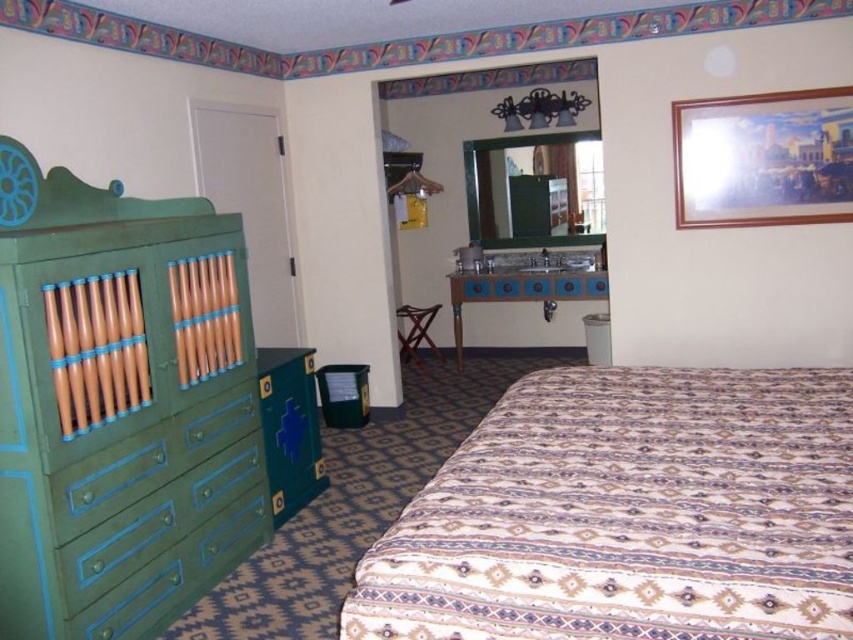
Can you confirm if green painted wood dresser at left is bigger than green matte drawer at left?

Yes, green painted wood dresser at left is bigger than green matte drawer at left.

What do you see at coordinates (119, 404) in the screenshot? I see `green painted wood dresser at left` at bounding box center [119, 404].

Locate an element on the screen. The image size is (853, 640). green painted wood dresser at left is located at coordinates (119, 404).

Which is more to the right, patterned fabric bed at lower right or green matte drawer at left?

Positioned to the right is patterned fabric bed at lower right.

Who is lower down, patterned fabric bed at lower right or green matte drawer at left?

green matte drawer at left

Which is in front, point (465, 545) or point (155, 580)?

Point (465, 545) is in front.

Identify the location of patterned fabric bed at lower right. tap(630, 515).

Image resolution: width=853 pixels, height=640 pixels. Describe the element at coordinates (630, 515) in the screenshot. I see `patterned fabric bed at lower right` at that location.

Is patterned fabric bed at lower right above green painted wood dresser at left?

Actually, patterned fabric bed at lower right is below green painted wood dresser at left.

Describe the element at coordinates (630, 515) in the screenshot. I see `patterned fabric bed at lower right` at that location.

You are a GUI agent. You are given a task and a screenshot of the screen. Output one action in this format:
    pyautogui.click(x=<x>, y=<y>)
    Task: Click on the patterned fabric bed at lower right
    The height and width of the screenshot is (640, 853).
    Given the screenshot: What is the action you would take?
    pyautogui.click(x=630, y=515)